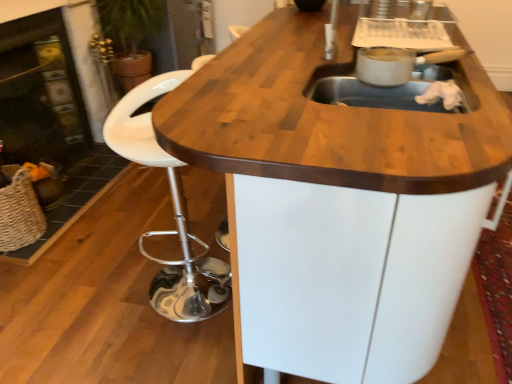
The width and height of the screenshot is (512, 384). What are the coordinates of `free spot in front of white plastic stool at lower left` in the screenshot? It's located at (160, 347).